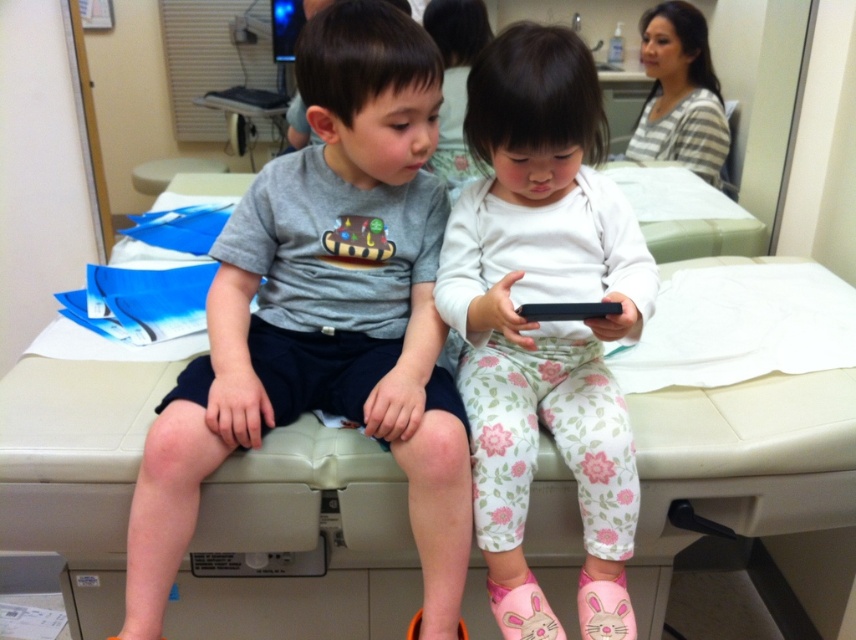
You are a nurse in the clinic and need to place two medical devices on the examination table. The first device must be placed at point (551,292) and the second at point (557,310). Which device will be closer to the children?

Point (551,292) is behind point (557,310), so the device placed at point (557,310) will be closer to the children.

You are a nurse in a clinic. You need to place a medical kit on the examination table between the gray matte shirt at center and the black matte smartphone at center. Based on their sizes, which object should the medical kit be placed closer to?

The medical kit should be placed closer to the gray matte shirt at center because it is larger than the black matte smartphone at center, providing more space around it.

What is the 2D coordinate of the gray matte shirt at center?

The gray matte shirt at center is located at the 2D coordinate point of [325,316].